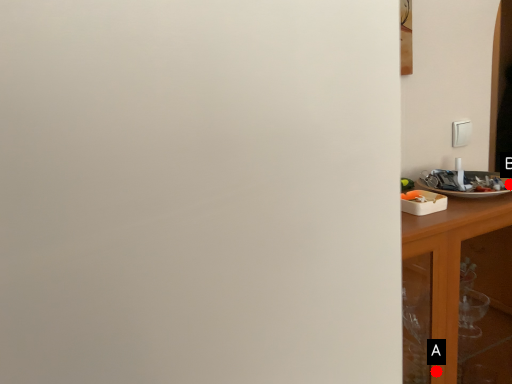
Question: Two points are circled on the image, labeled by A and B beside each circle. Which point appears closest to the camera in this image?

Choices:
 (A) A is closer
 (B) B is closer

Answer: (A)